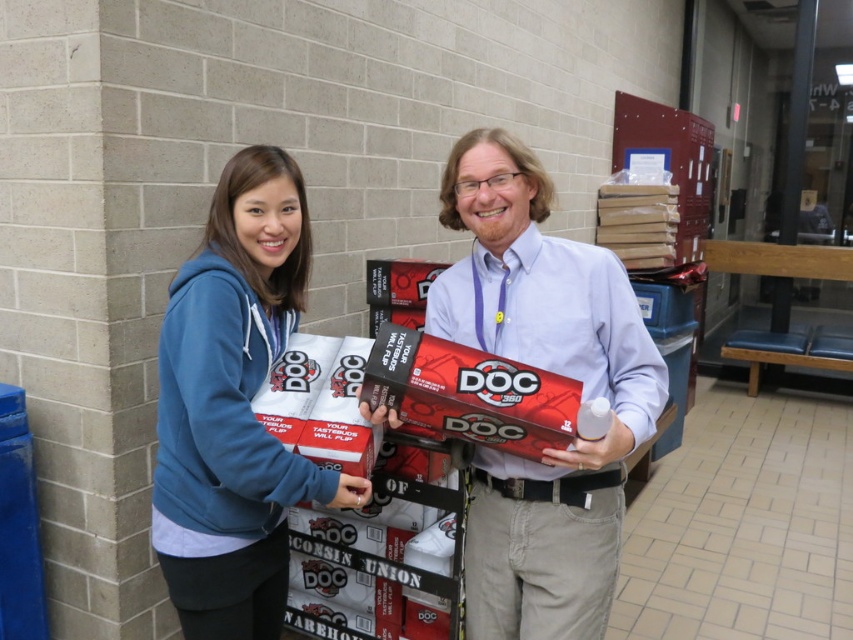
What is the location of the point with coordinates (546, 369) in the image?

The point with coordinates (546, 369) is on the matte white box at center.

Consider the image. You are a security camera in the warehouse. You need to track the blue fleece hoodie at left. What are the coordinates of its position?

The coordinates of the blue fleece hoodie at left are at point (x=234, y=406).